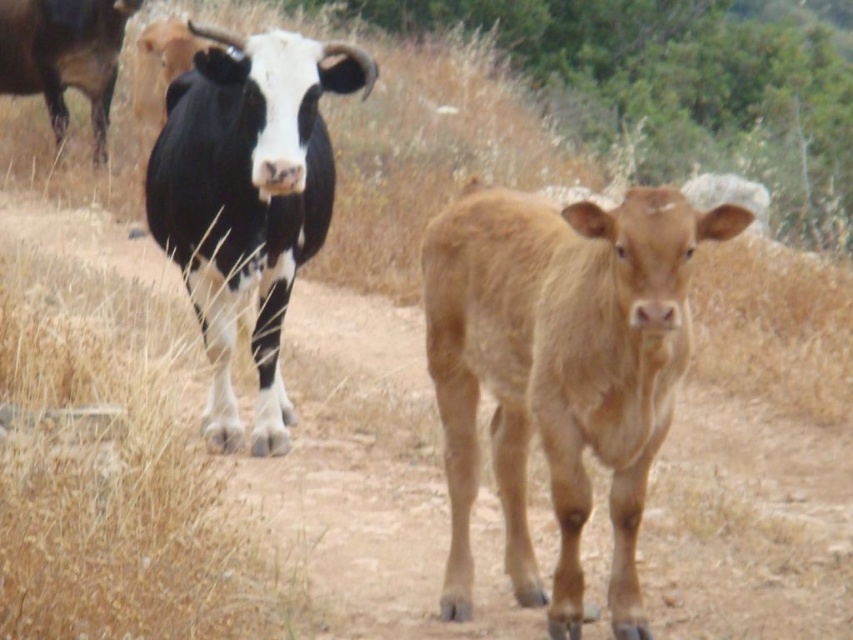
You are a farmer who needs to separate the brown smooth calf at center and the black and white fur at center using a fence. Since both are at the center, which direction should you build the fence to separate them?

The brown smooth calf at center is to the right of black and white fur at center, so building the fence to the left of the brown smooth calf at center would separate them.

You are a farmer checking your herd. You notice two cows in the field. One is the black and white fur at center and the other is the black glossy cow at upper left. Which cow would you need to approach more carefully due to its size?

The black and white fur at center is bigger than the black glossy cow at upper left, so you should approach the black and white fur at center more carefully because of its larger size.

You are a farmer checking the herd. You see the brown smooth calf at center and the black glossy cow at upper left. Which one is positioned more to the right side of the scene?

The brown smooth calf at center is positioned more to the right side of the scene than the black glossy cow at upper left.